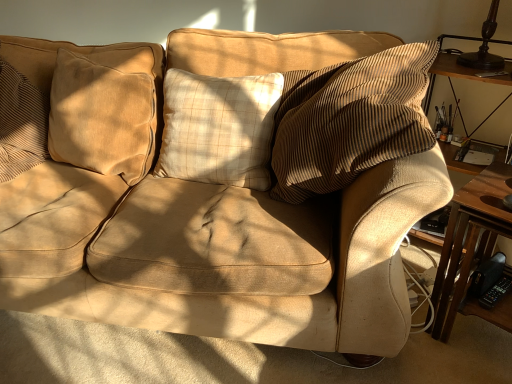
Question: Considering the relative sizes of wooden table at right and beige plaid pillow at center, which ranks as the second pillow in left-to-right order, in the image provided, is wooden table at right shorter than beige plaid pillow at center, which ranks as the second pillow in left-to-right order,?

Choices:
 (A) no
 (B) yes

Answer: (A)

Question: Is wooden table at right to the right of beige plaid pillow at center, which ranks as the second pillow in left-to-right order, from the viewer's perspective?

Choices:
 (A) yes
 (B) no

Answer: (A)

Question: From a real-world perspective, is wooden table at right located beneath beige plaid pillow at center, positioned as the 1th pillow in right-to-left order?

Choices:
 (A) no
 (B) yes

Answer: (B)

Question: Considering the relative sizes of wooden table at right and beige plaid pillow at center, positioned as the 1th pillow in right-to-left order, in the image provided, is wooden table at right thinner than beige plaid pillow at center, positioned as the 1th pillow in right-to-left order,?

Choices:
 (A) no
 (B) yes

Answer: (A)

Question: From the image's perspective, is wooden table at right below beige plaid pillow at center, positioned as the 1th pillow in right-to-left order?

Choices:
 (A) yes
 (B) no

Answer: (A)

Question: Considering the positions of wooden table at right and beige plaid pillow at center, positioned as the 1th pillow in right-to-left order, in the image, is wooden table at right taller or shorter than beige plaid pillow at center, positioned as the 1th pillow in right-to-left order,?

Choices:
 (A) short
 (B) tall

Answer: (B)

Question: In the image, is wooden table at right positioned in front of or behind beige plaid pillow at center, positioned as the 1th pillow in right-to-left order?

Choices:
 (A) front
 (B) behind

Answer: (A)

Question: Visually, is wooden table at right positioned to the left or to the right of beige plaid pillow at center, positioned as the 1th pillow in right-to-left order?

Choices:
 (A) right
 (B) left

Answer: (A)

Question: Does point (486, 256) appear closer or farther from the camera than point (246, 147)?

Choices:
 (A) closer
 (B) farther

Answer: (A)

Question: Which is correct: suede-like beige pillow at left, marked as the 1th pillow in a left-to-right arrangement, is inside wooden table at right, or outside of it?

Choices:
 (A) outside
 (B) inside

Answer: (A)

Question: Considering the positions of suede-like beige pillow at left, placed as the 2th pillow when sorted from right to left, and wooden table at right in the image, is suede-like beige pillow at left, placed as the 2th pillow when sorted from right to left, wider or thinner than wooden table at right?

Choices:
 (A) wide
 (B) thin

Answer: (B)

Question: Based on their positions, is suede-like beige pillow at left, placed as the 2th pillow when sorted from right to left, located to the left or right of wooden table at right?

Choices:
 (A) right
 (B) left

Answer: (B)

Question: Relative to wooden table at right, is suede-like beige pillow at left, placed as the 2th pillow when sorted from right to left, in front or behind?

Choices:
 (A) front
 (B) behind

Answer: (B)

Question: From the image's perspective, relative to suede-like beige pillow at left, placed as the 2th pillow when sorted from right to left, is wooden table at right above or below?

Choices:
 (A) below
 (B) above

Answer: (A)

Question: From a real-world perspective, is wooden table at right positioned above or below suede-like beige pillow at left, placed as the 2th pillow when sorted from right to left?

Choices:
 (A) below
 (B) above

Answer: (A)